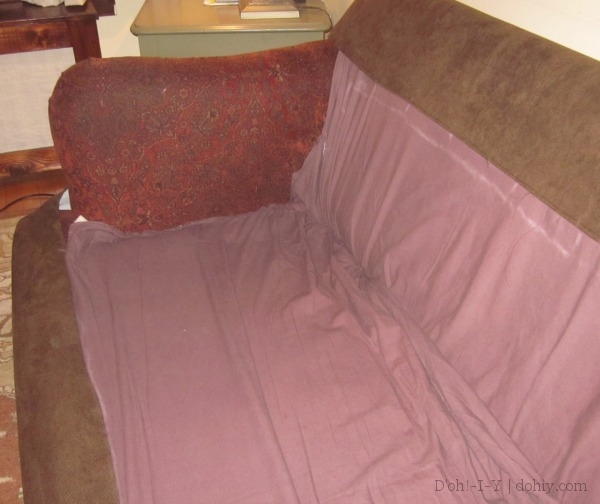
The width and height of the screenshot is (600, 504). I want to click on paisely patter on couch, so click(202, 161).